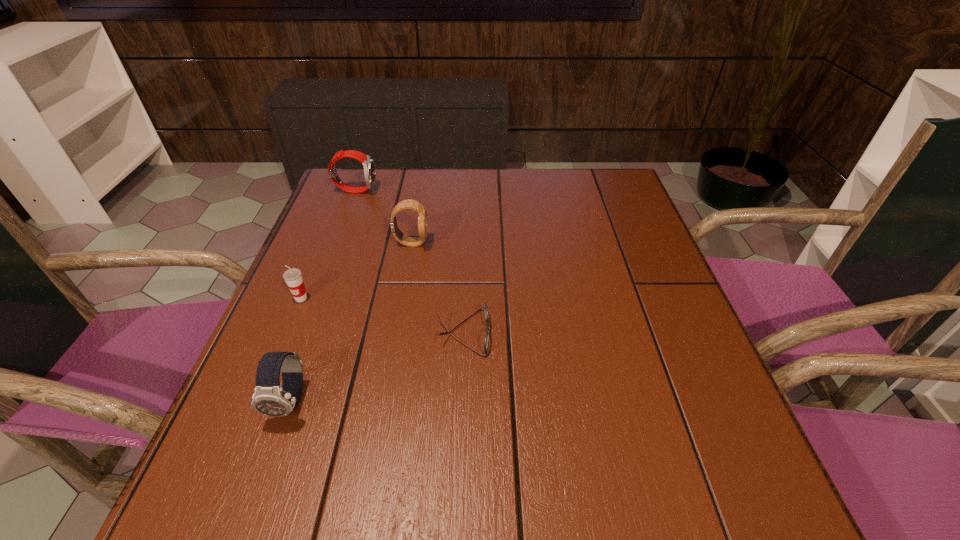
Find the location of a particular element. The height and width of the screenshot is (540, 960). vacant space in between the fourth nearest object and the fourth farthest object is located at coordinates (438, 288).

Where is `vacant area that lies between the second farthest watch and the farthest object`? The height and width of the screenshot is (540, 960). vacant area that lies between the second farthest watch and the farthest object is located at coordinates (383, 217).

The height and width of the screenshot is (540, 960). In order to click on vacant area between the shortest object and the rightmost watch in this screenshot , I will do `click(438, 288)`.

Where is `free space between the fourth tallest object and the farthest watch`? This screenshot has height=540, width=960. free space between the fourth tallest object and the farthest watch is located at coordinates (328, 244).

Locate which object is the third closest to the spectacles. Please provide its 2D coordinates. Your answer should be formatted as a tuple, i.e. [(x, y)], where the tuple contains the x and y coordinates of a point satisfying the conditions above.

[(293, 278)]

Choose which object is the fourth nearest neighbor to the cup. Please provide its 2D coordinates. Your answer should be formatted as a tuple, i.e. [(x, y)], where the tuple contains the x and y coordinates of a point satisfying the conditions above.

[(368, 164)]

Identify the location of watch that is the third closest to the second shortest object. The image size is (960, 540). (368, 164).

Identify which watch is the second nearest to the nearest object. Please provide its 2D coordinates. Your answer should be formatted as a tuple, i.e. [(x, y)], where the tuple contains the x and y coordinates of a point satisfying the conditions above.

[(368, 164)]

This screenshot has width=960, height=540. Identify the location of vacant area that satisfies the following two spatial constraints: 1. on the face of the second nearest watch; 2. on the face of the nearest object. (382, 401).

Locate an element on the screen. free region that satisfies the following two spatial constraints: 1. on the front-facing side of the second nearest object; 2. on the face of the nearest watch is located at coordinates (461, 401).